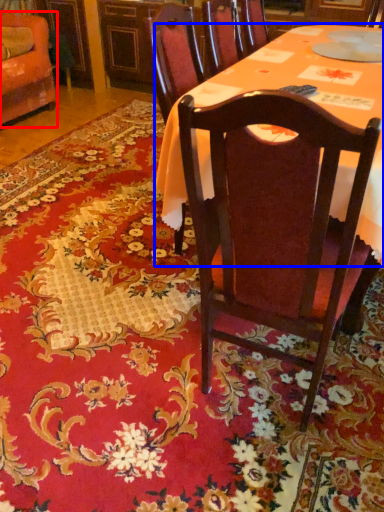
Question: Which object appears closest to the camera in this image, chair (highlighted by a red box) or desk (highlighted by a blue box)?

Choices:
 (A) chair
 (B) desk

Answer: (B)